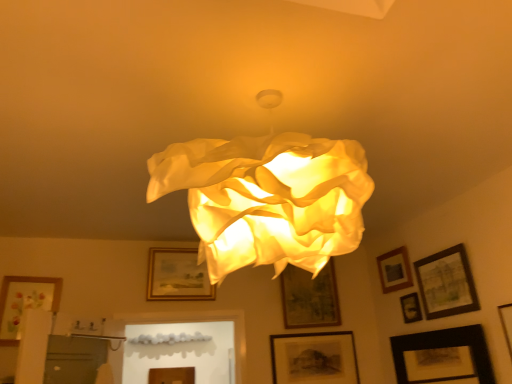
Question: From a real-world perspective, relative to wooden picture frame at lower center, the 9th picture frame in the right-to-left sequence, is wooden framed picture at center, which appears as the 4th picture frame when viewed from the left, vertically above or below?

Choices:
 (A) above
 (B) below

Answer: (A)

Question: In the image, is wooden framed picture at center, which appears as the 4th picture frame when viewed from the left, positioned in front of or behind wooden picture frame at lower center, which is the 2th picture frame in left-to-right order?

Choices:
 (A) behind
 (B) front

Answer: (B)

Question: Considering the real-world distances, which object is closest to the matte floral print picture frame at lower left, which is the tenth picture frame in right-to-left order?

Choices:
 (A) matte black picture frame at lower right, placed as the seventh picture frame when sorted from left to right
 (B) black matte picture frame at lower right, the third picture frame in the right-to-left sequence
 (C) wooden framed picture at upper right, placed as the second picture frame when sorted from right to left
 (D) wooden picture frame at lower center, which is the 2th picture frame in left-to-right order
 (E) wooden framed picture at center, which ranks as the 7th picture frame in right-to-left order

Answer: (D)

Question: Based on their relative distances, which object is farther from the black matte picture frame at lower center, positioned as the sixth picture frame in right-to-left order?

Choices:
 (A) wooden framed picture at center, which ranks as the 7th picture frame in right-to-left order
 (B) wooden picture frame at upper right, the 5th picture frame viewed from the right
 (C) wooden picture frame at lower right, the tenth picture frame positioned from the left
 (D) wooden framed picture at upper right, which is the ninth picture frame in left-to-right order
 (E) black matte picture frame at lower right, the third picture frame in the right-to-left sequence

Answer: (C)